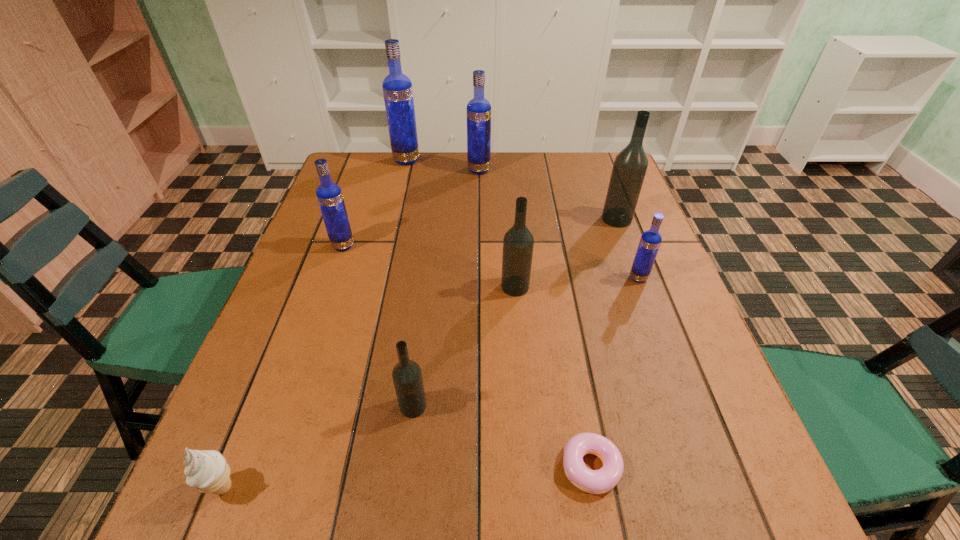
Where is `icecream at the left edge`? Image resolution: width=960 pixels, height=540 pixels. icecream at the left edge is located at coordinates (207, 470).

Locate an element on the screen. This screenshot has height=540, width=960. object that is positioned at the near left corner is located at coordinates [207, 470].

In the image, there is a desktop. Where is `free space at the far edge`? This screenshot has height=540, width=960. free space at the far edge is located at coordinates (485, 173).

Identify the location of vacant area at the near edge of the desktop. The width and height of the screenshot is (960, 540). (328, 528).

Find the location of a particular element. The width and height of the screenshot is (960, 540). vacant space at the left edge of the desktop is located at coordinates (359, 237).

Find the location of a particular element. free space at the right edge of the desktop is located at coordinates (627, 260).

Identify the location of vacant space in between the second black vodka from left to right and the icecream. The image size is (960, 540). (370, 387).

I want to click on free point between the leftmost black vodka and the leftmost object, so click(319, 447).

Where is `vacant point located between the second blue vodka from left to right and the second biggest black vodka`? vacant point located between the second blue vodka from left to right and the second biggest black vodka is located at coordinates (461, 224).

The width and height of the screenshot is (960, 540). Identify the location of vacant area that lies between the icecream and the third farthest blue vodka. (283, 366).